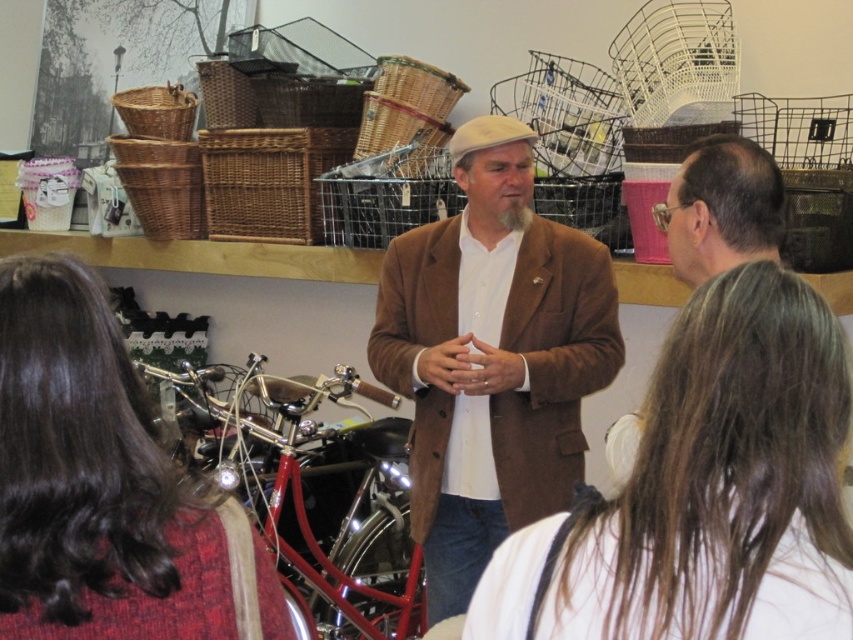
You are an observer in the scene. You notice the brown woolen coat at center and the dark brown hair at center. Which object is positioned higher in the image?

The brown woolen coat at center is above dark brown hair at center, so the brown woolen coat at center is positioned higher in the image.

You are standing in the scene and want to see the shiny chrome motorcycle at center without moving your head. Can you see it while looking at the smooth brown hair at center?

Yes, because the smooth brown hair at center is located above the shiny chrome motorcycle at center, so looking at the hair would allow you to see the motorcycle below it without moving your head.